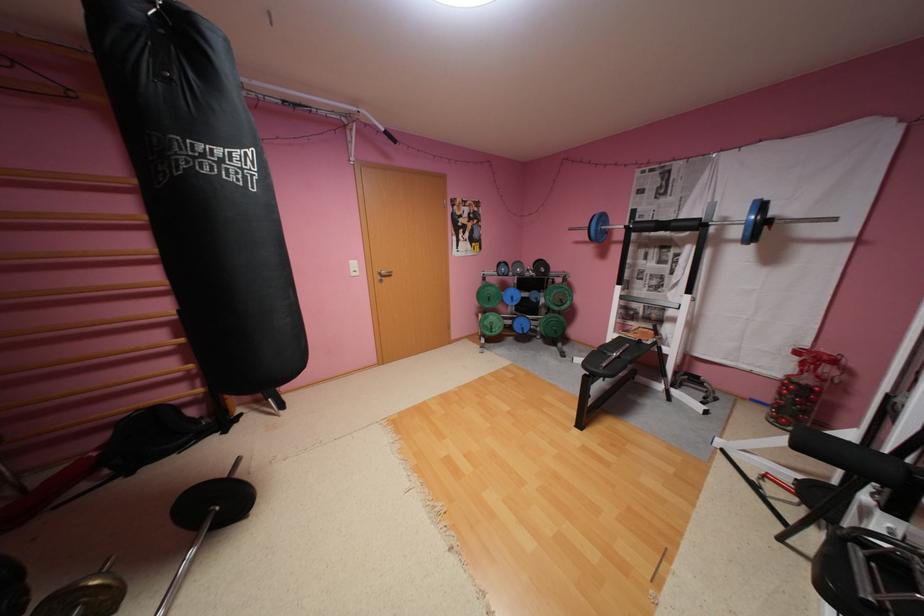
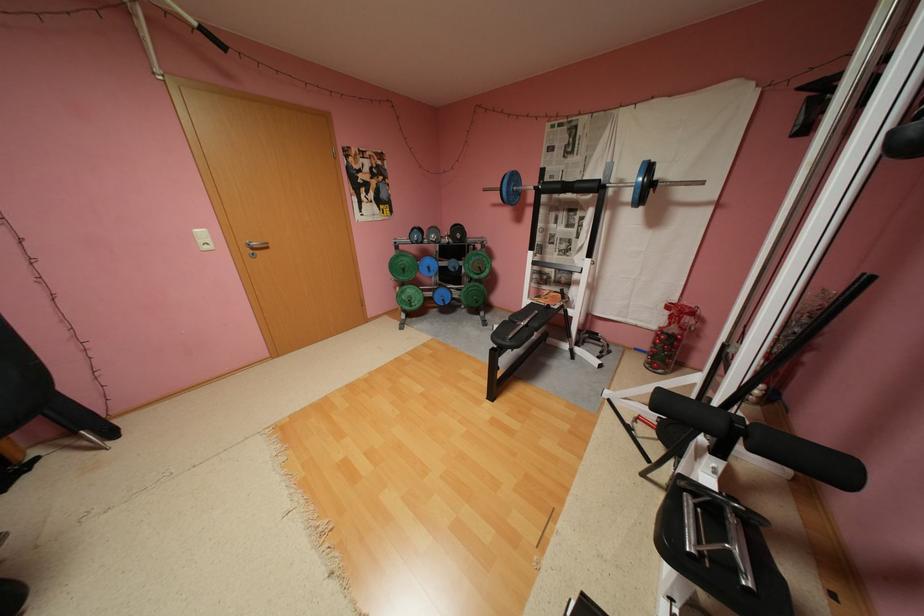
The point at (x=604, y=230) is marked in the first image. Where is the corresponding point in the second image?

(517, 191)